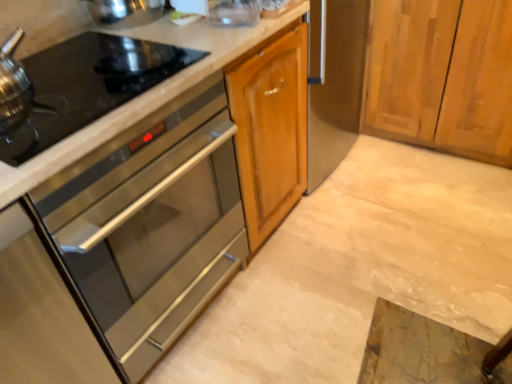
Question: Is black glass gas stove at left positioned with its back to marble countertop at center?

Choices:
 (A) no
 (B) yes

Answer: (A)

Question: Does black glass gas stove at left have a larger size compared to marble countertop at center?

Choices:
 (A) yes
 (B) no

Answer: (B)

Question: Is black glass gas stove at left outside marble countertop at center?

Choices:
 (A) yes
 (B) no

Answer: (A)

Question: From the image's perspective, is black glass gas stove at left below marble countertop at center?

Choices:
 (A) no
 (B) yes

Answer: (A)

Question: Is black glass gas stove at left smaller than marble countertop at center?

Choices:
 (A) no
 (B) yes

Answer: (B)

Question: Looking at their shapes, would you say stainless steel oven at left is wider or thinner than black glass gas stove at left?

Choices:
 (A) thin
 (B) wide

Answer: (B)

Question: Choose the correct answer: Is stainless steel oven at left inside black glass gas stove at left or outside it?

Choices:
 (A) outside
 (B) inside

Answer: (A)

Question: In the image, is stainless steel oven at left positioned in front of or behind black glass gas stove at left?

Choices:
 (A) front
 (B) behind

Answer: (A)

Question: Is stainless steel oven at left taller or shorter than black glass gas stove at left?

Choices:
 (A) short
 (B) tall

Answer: (B)

Question: Considering the relative positions of stainless steel oven at left and marble countertop at center in the image provided, is stainless steel oven at left to the left or to the right of marble countertop at center?

Choices:
 (A) left
 (B) right

Answer: (A)

Question: Is point (83, 355) closer or farther from the camera than point (413, 226)?

Choices:
 (A) closer
 (B) farther

Answer: (A)

Question: From a real-world perspective, is stainless steel oven at left above or below marble countertop at center?

Choices:
 (A) below
 (B) above

Answer: (B)

Question: Based on their sizes in the image, would you say stainless steel oven at left is bigger or smaller than marble countertop at center?

Choices:
 (A) big
 (B) small

Answer: (A)

Question: From the image's perspective, relative to black glass gas stove at left, is marble countertop at center above or below?

Choices:
 (A) below
 (B) above

Answer: (A)

Question: Considering the relative positions of marble countertop at center and black glass gas stove at left in the image provided, is marble countertop at center to the left or to the right of black glass gas stove at left?

Choices:
 (A) right
 (B) left

Answer: (A)